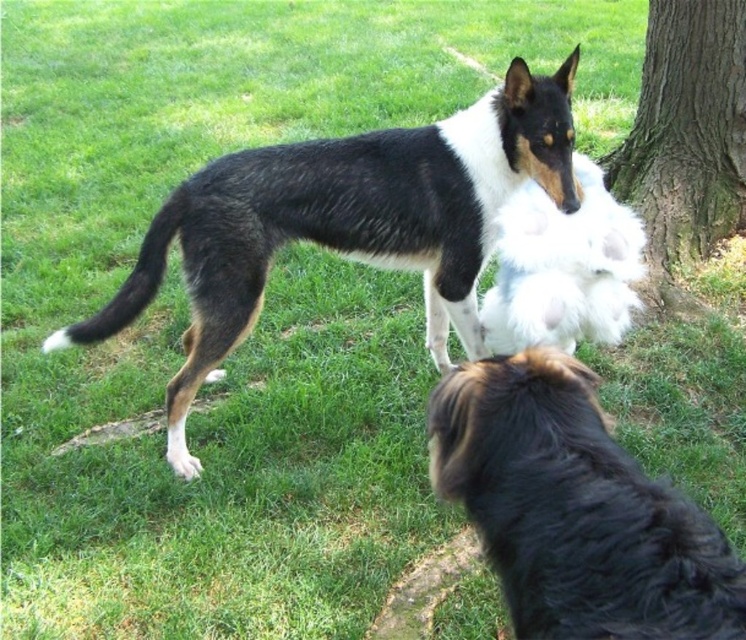
You are a photographer trying to capture a photo of the black and white fur at center and the brown rough bark tree at right. If you want to ensure both are in focus, which one should you focus on first to get the best depth of field?

The black and white fur at center is below brown rough bark tree at right, so focusing on the brown rough bark tree at right first will ensure both are in focus because it is closer to the camera.

You are a dog owner who wants to ensure your black fluffy dog at lower right can comfortably carry the fluffy white stuffed toy at center in its mouth. Based on the size comparison between them, do you think the dog can hold the toy without difficulty?

The black fluffy dog at lower right is smaller than the fluffy white stuffed toy at center, so it might be challenging for the dog to hold the toy comfortably in its mouth due to the size difference.

Consider the image. You are a dog owner who wants to ensure your black fluffy dog at lower right can reach its fluffy white stuffed toy at center. Based on the scene, is the toy placed at a reachable height for the dog?

The black fluffy dog at lower right has a lesser height compared to the fluffy white stuffed toy at center, so the toy may be too high for the dog to reach comfortably. Consider lowering it to the dog